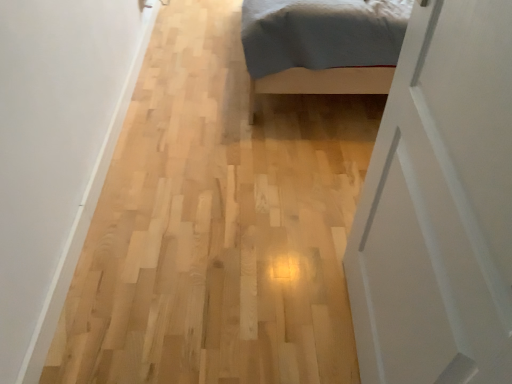
At what (x,y) coordinates should I click in order to perform the action: click on vacant space situated on the left part of white matte door at right. Please return your answer as a coordinate pair (x, y). The height and width of the screenshot is (384, 512). Looking at the image, I should click on (271, 316).